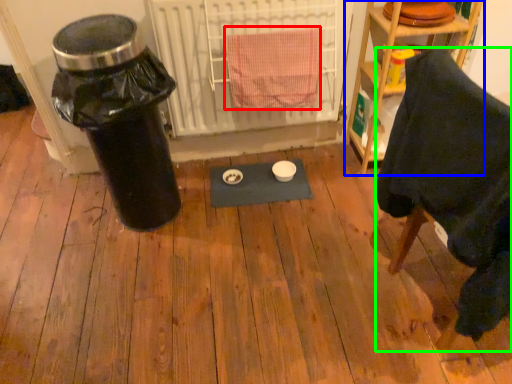
Question: Estimate the real-world distances between objects in this image. Which object is closer to bath towel (highlighted by a red box), shelf (highlighted by a blue box) or furniture (highlighted by a green box)?

Choices:
 (A) shelf
 (B) furniture

Answer: (A)